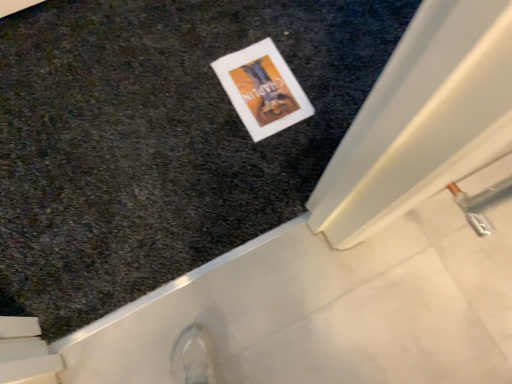
Locate an element on the screen. This screenshot has width=512, height=384. white paper at center is located at coordinates (262, 89).

Describe the element at coordinates (262, 89) in the screenshot. I see `white paper at center` at that location.

From the picture: What is the approximate width of white paper at center?

It is 11.95 inches.

This screenshot has width=512, height=384. Identify the location of white paper at center. (262, 89).